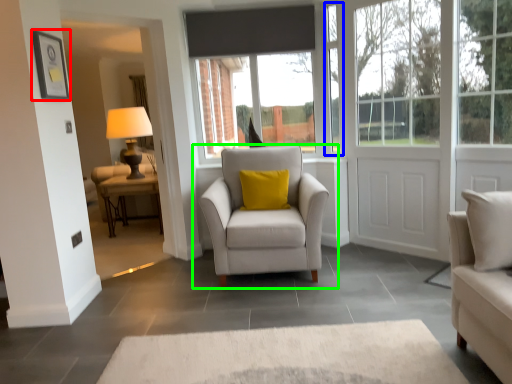
Question: Which object is positioned closest to picture frame (highlighted by a red box)? Select from window frame (highlighted by a blue box) and chair (highlighted by a green box).

Choices:
 (A) window frame
 (B) chair

Answer: (B)